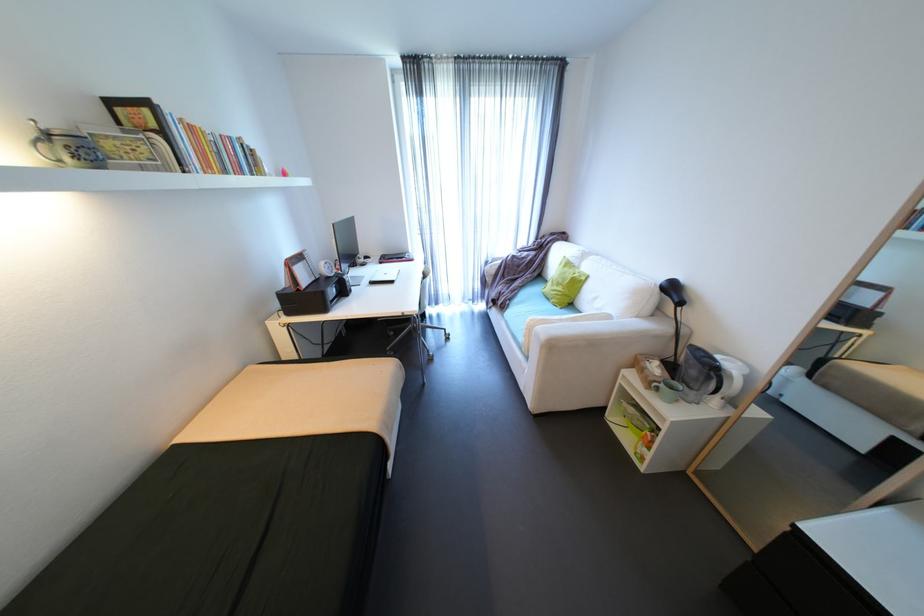
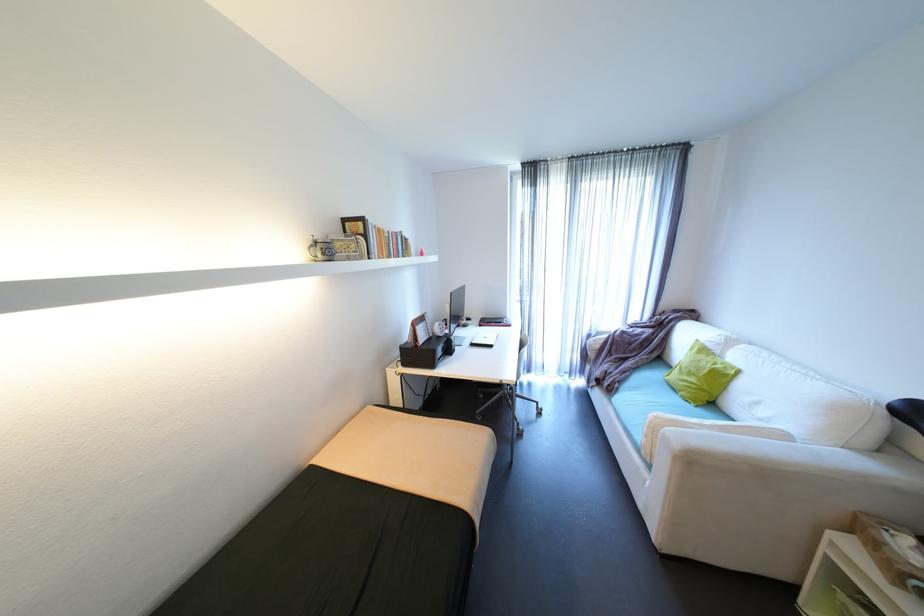
Where in the second image is the point corresponding to the point at 664,337 from the first image?

(907, 493)